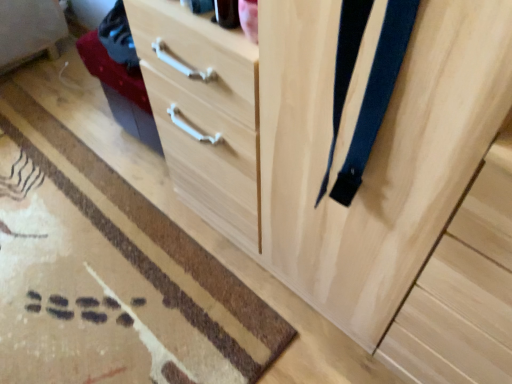
Question: Can you confirm if brown woven mat at lower left is positioned to the right of dark blue fabric suspenders at right?

Choices:
 (A) no
 (B) yes

Answer: (A)

Question: Does brown woven mat at lower left have a greater height compared to dark blue fabric suspenders at right?

Choices:
 (A) no
 (B) yes

Answer: (A)

Question: Considering the relative positions of brown woven mat at lower left and dark blue fabric suspenders at right in the image provided, is brown woven mat at lower left to the left of dark blue fabric suspenders at right from the viewer's perspective?

Choices:
 (A) yes
 (B) no

Answer: (A)

Question: From the image's perspective, would you say brown woven mat at lower left is positioned over dark blue fabric suspenders at right?

Choices:
 (A) yes
 (B) no

Answer: (B)

Question: Considering the relative sizes of brown woven mat at lower left and dark blue fabric suspenders at right in the image provided, is brown woven mat at lower left shorter than dark blue fabric suspenders at right?

Choices:
 (A) no
 (B) yes

Answer: (B)

Question: Can we say brown woven mat at lower left lies outside dark blue fabric suspenders at right?

Choices:
 (A) yes
 (B) no

Answer: (A)

Question: Is dark blue fabric suspenders at right at the right side of brown woven mat at lower left?

Choices:
 (A) no
 (B) yes

Answer: (B)

Question: From a real-world perspective, is dark blue fabric suspenders at right beneath brown woven mat at lower left?

Choices:
 (A) yes
 (B) no

Answer: (B)

Question: Is dark blue fabric suspenders at right turned away from brown woven mat at lower left?

Choices:
 (A) no
 (B) yes

Answer: (A)

Question: From a real-world perspective, is dark blue fabric suspenders at right physically above brown woven mat at lower left?

Choices:
 (A) no
 (B) yes

Answer: (B)

Question: Is dark blue fabric suspenders at right further to the viewer compared to brown woven mat at lower left?

Choices:
 (A) yes
 (B) no

Answer: (B)

Question: Is dark blue fabric suspenders at right positioned far away from brown woven mat at lower left?

Choices:
 (A) yes
 (B) no

Answer: (B)

Question: Considering the positions of brown woven mat at lower left and dark blue fabric suspenders at right in the image, is brown woven mat at lower left taller or shorter than dark blue fabric suspenders at right?

Choices:
 (A) short
 (B) tall

Answer: (A)